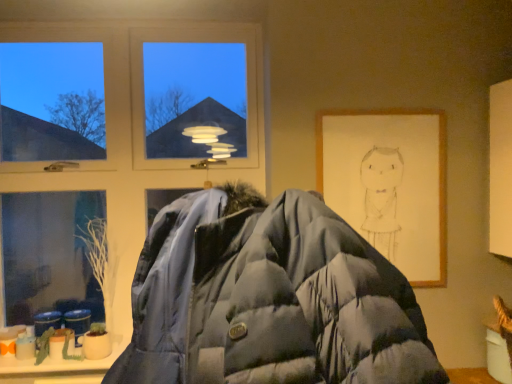
What is the approximate width of matte blue puffer jacket at center?

matte blue puffer jacket at center is 31.04 inches wide.

Measure the distance between transparent glass window at upper left and camera.

They are 1.83 meters apart.

In order to click on matte blue puffer jacket at center in this screenshot , I will do `click(269, 299)`.

Based on the photo, is wooden framed drawing at right wider than matte blue puffer jacket at center?

In fact, wooden framed drawing at right might be narrower than matte blue puffer jacket at center.

From the image's perspective, relative to matte blue puffer jacket at center, is wooden framed drawing at right above or below?

wooden framed drawing at right is above matte blue puffer jacket at center.

Between point (361, 175) and point (221, 343), which one is positioned in front?

The point (221, 343) is closer to the camera.

Could you tell me if transparent glass window at upper left is turned towards wooden framed drawing at right?

No.

From a real-world perspective, is transparent glass window at upper left above or below wooden framed drawing at right?

transparent glass window at upper left is above wooden framed drawing at right.

Which is in front, point (27, 39) or point (402, 215)?

Point (402, 215)

Can you tell me how much transparent glass window at upper left and wooden framed drawing at right differ in facing direction?

There is a 0.189-degree angle between the facing directions of transparent glass window at upper left and wooden framed drawing at right.

Can you confirm if matte blue puffer jacket at center is bigger than transparent glass window at upper left?

Yes.

Can we say matte blue puffer jacket at center lies outside transparent glass window at upper left?

matte blue puffer jacket at center is positioned outside transparent glass window at upper left.

Is point (197, 357) positioned in front of point (127, 159)?

Yes.

Can you see transparent glass window at upper left touching matte blue puffer jacket at center?

No, transparent glass window at upper left is not touching matte blue puffer jacket at center.

Is transparent glass window at upper left bigger than matte blue puffer jacket at center?

Actually, transparent glass window at upper left might be smaller than matte blue puffer jacket at center.

Can you tell me how much transparent glass window at upper left and matte blue puffer jacket at center differ in facing direction?

1.67 degrees separate the facing orientations of transparent glass window at upper left and matte blue puffer jacket at center.

Does matte blue puffer jacket at center have a lesser height compared to wooden framed drawing at right?

Yes.

Consider the image. Which object is closer to the camera taking this photo, matte blue puffer jacket at center or wooden framed drawing at right?

matte blue puffer jacket at center.

Can you tell me how much matte blue puffer jacket at center and wooden framed drawing at right differ in facing direction?

1.86 degrees separate the facing orientations of matte blue puffer jacket at center and wooden framed drawing at right.

Identify the location of jacket below the wooden framed drawing at right (from the image's perspective). This screenshot has height=384, width=512. tap(269, 299).

Where is `picture frame to the right of transparent glass window at upper left`? This screenshot has width=512, height=384. picture frame to the right of transparent glass window at upper left is located at coordinates (389, 183).

Is there a large distance between wooden framed drawing at right and transparent glass window at upper left?

Actually, wooden framed drawing at right and transparent glass window at upper left are a little close together.

Choose the correct answer: Is wooden framed drawing at right inside transparent glass window at upper left or outside it?

wooden framed drawing at right is spatially situated outside transparent glass window at upper left.

Where is `picture frame above the matte blue puffer jacket at center (from a real-world perspective)`? The height and width of the screenshot is (384, 512). picture frame above the matte blue puffer jacket at center (from a real-world perspective) is located at coordinates (389, 183).

Where is `picture frame beneath the transparent glass window at upper left (from a real-world perspective)`? picture frame beneath the transparent glass window at upper left (from a real-world perspective) is located at coordinates (389, 183).

Looking at the image, which one is located further to transparent glass window at upper left, matte blue puffer jacket at center or wooden framed drawing at right?

matte blue puffer jacket at center is positioned further to the anchor transparent glass window at upper left.

From the image, which object appears to be farther from wooden framed drawing at right, transparent glass window at upper left or matte blue puffer jacket at center?

Based on the image, matte blue puffer jacket at center appears to be further to wooden framed drawing at right.

Based on their spatial positions, is matte blue puffer jacket at center or transparent glass window at upper left closer to wooden framed drawing at right?

The object closer to wooden framed drawing at right is transparent glass window at upper left.

When comparing their distances from matte blue puffer jacket at center, does transparent glass window at upper left or wooden framed drawing at right seem further?

transparent glass window at upper left is positioned further to the anchor matte blue puffer jacket at center.

Estimate the real-world distances between objects in this image. Which object is closer to transparent glass window at upper left, wooden framed drawing at right or matte blue puffer jacket at center?

Based on the image, wooden framed drawing at right appears to be nearer to transparent glass window at upper left.

When comparing their distances from matte blue puffer jacket at center, does wooden framed drawing at right or transparent glass window at upper left seem closer?

wooden framed drawing at right is positioned closer to the anchor matte blue puffer jacket at center.

Where is `picture frame located between matte blue puffer jacket at center and transparent glass window at upper left in the depth direction`? picture frame located between matte blue puffer jacket at center and transparent glass window at upper left in the depth direction is located at coordinates (389, 183).